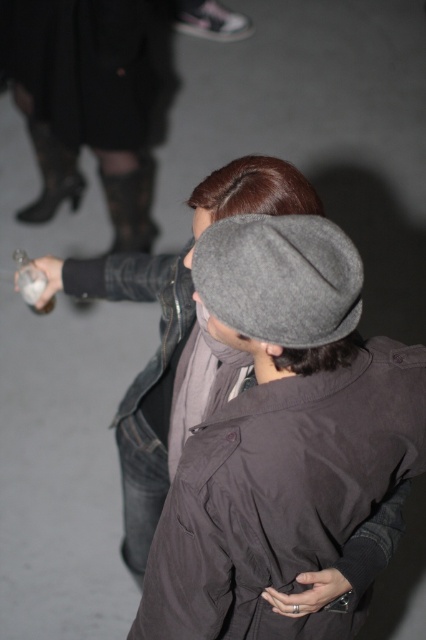
Question: Does gray woolen cap at center appear on the left side of translucent glass bottle at lower left?

Choices:
 (A) yes
 (B) no

Answer: (B)

Question: Is matte gray cap at center wider than gray woolen cap at center?

Choices:
 (A) yes
 (B) no

Answer: (B)

Question: Which object is closer to the camera taking this photo?

Choices:
 (A) gray woolen cap at center
 (B) matte gray cap at center

Answer: (B)

Question: Which point is closer to the camera taking this photo?

Choices:
 (A) (175, 499)
 (B) (146, 368)
 (C) (42, 278)

Answer: (A)

Question: Which object appears farthest from the camera in this image?

Choices:
 (A) matte gray cap at center
 (B) gray woolen cap at center
 (C) translucent glass bottle at lower left

Answer: (C)

Question: From the image, what is the correct spatial relationship of matte gray cap at center in relation to translucent glass bottle at lower left?

Choices:
 (A) left
 (B) right

Answer: (B)